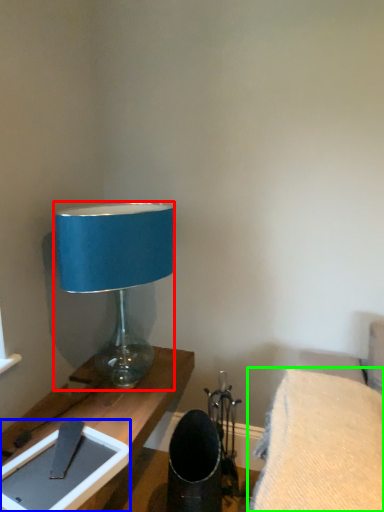
Question: Considering the real-world distances, which object is farthest from lamp (highlighted by a red box)? tablet computer (highlighted by a blue box) or furniture (highlighted by a green box)?

Choices:
 (A) tablet computer
 (B) furniture

Answer: (B)